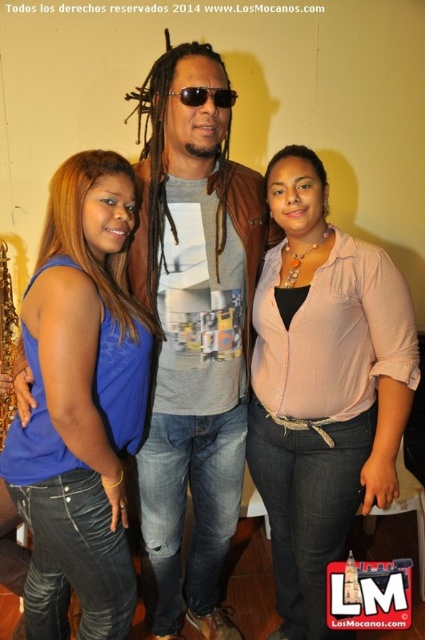
Based on the scene described, can you determine if the pink satin blouse at center is wider than the sunglasses at center?

The pink satin blouse at center is wider than sunglasses at center according to the objects description.

You are a photographer trying to adjust the lighting for a group photo. You notice the pink satin blouse at center and the blue denim jeans at center. Which clothing item requires more light to ensure it stands out in the photo?

The pink satin blouse at center has a larger size compared to blue denim jeans at center, so it would require more light to ensure it stands out in the photo.